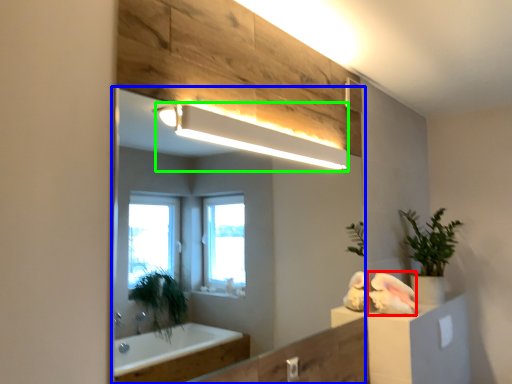
Question: Which is farther away from animal (highlighted by a red box)? mirror (highlighted by a blue box) or light fixture (highlighted by a green box)?

Choices:
 (A) mirror
 (B) light fixture

Answer: (A)